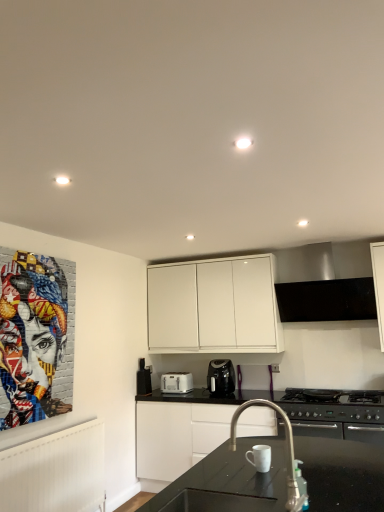
Measure the distance between point (191, 378) and camera.

The depth of point (191, 378) is 4.63 meters.

What do you see at coordinates (221, 377) in the screenshot? The image size is (384, 512). I see `black plastic coffee maker at center, which ranks as the 1th kitchen appliance in right-to-left order` at bounding box center [221, 377].

In the scene shown: In order to face black plastic coffee maker at center, which ranks as the 1th kitchen appliance in right-to-left order, should I rotate leftwards or rightwards?

You should look right and rotate roughly 3.777 degrees.

In the scene shown: Measure the distance between point (x=5, y=273) and camera.

The depth of point (x=5, y=273) is 2.90 meters.

Where is `black plastic toaster at lower center, which ranks as the first appliance in back-to-front order`? The height and width of the screenshot is (512, 384). black plastic toaster at lower center, which ranks as the first appliance in back-to-front order is located at coordinates (143, 378).

What do you see at coordinates (217, 502) in the screenshot? The image size is (384, 512). I see `black glossy sink at center` at bounding box center [217, 502].

The height and width of the screenshot is (512, 384). What are the coordinates of `satin nickel faucet at center` in the screenshot? It's located at (288, 456).

You are a GUI agent. You are given a task and a screenshot of the screen. Output one action in this format:
    pyautogui.click(x=<x>, y=<y>)
    Task: Click on the white plastic toaster at center, the 1th kitchen appliance from the left
    The height and width of the screenshot is (512, 384).
    Given the screenshot: What is the action you would take?
    pyautogui.click(x=176, y=382)

Is white plastic toaster at center, the second kitchen appliance positioned from the right, placed right next to satin nickel faucet at center?

No, white plastic toaster at center, the second kitchen appliance positioned from the right, is not making contact with satin nickel faucet at center.

From the image's perspective, which is below, white plastic toaster at center, the second kitchen appliance positioned from the right, or satin nickel faucet at center?

white plastic toaster at center, the second kitchen appliance positioned from the right, appears lower in the image.

Considering the points (192, 388) and (302, 498), which point is behind, point (192, 388) or point (302, 498)?

Positioned behind is point (192, 388).

Can satin nickel faucet at center be found inside white plastic toaster at center, the 1th kitchen appliance from the left?

No, white plastic toaster at center, the 1th kitchen appliance from the left, does not contain satin nickel faucet at center.

Looking at this image, which is more distant, (223, 382) or (266, 458)?

The point (223, 382) is behind.

From the image's perspective, is black plastic coffee maker at center, which ranks as the 1th kitchen appliance in right-to-left order, beneath white ceramic mug at lower center, the second appliance positioned from the back?

Correct, black plastic coffee maker at center, which ranks as the 1th kitchen appliance in right-to-left order, appears lower than white ceramic mug at lower center, the second appliance positioned from the back, in the image.

How different are the orientations of black plastic coffee maker at center, which ranks as the 1th kitchen appliance in right-to-left order, and white ceramic mug at lower center, the first appliance in the top-to-bottom sequence, in degrees?

They differ by 93 degrees in their facing directions.

Is black plastic coffee maker at center, which ranks as the 1th kitchen appliance in right-to-left order, turned away from white ceramic mug at lower center, placed as the 1th appliance when sorted from right to left?

No, black plastic coffee maker at center, which ranks as the 1th kitchen appliance in right-to-left order,'s orientation is not away from white ceramic mug at lower center, placed as the 1th appliance when sorted from right to left.

Based on the photo, what's the angular difference between white ceramic mug at lower center, the second appliance positioned from the back, and white plastic toaster at center, the second kitchen appliance positioned from the right,'s facing directions?

The angle between the facing direction of white ceramic mug at lower center, the second appliance positioned from the back, and the facing direction of white plastic toaster at center, the second kitchen appliance positioned from the right, is 93 degrees.

From the picture: Is white ceramic mug at lower center, which is the 2th appliance from bottom to top, far from white plastic toaster at center, the 1th kitchen appliance from the left?

Yes.

Identify the location of appliance below the white plastic toaster at center, the 1th kitchen appliance from the left (from a real-world perspective). (260, 457).

Based on the photo, could white plastic toaster at center, the second kitchen appliance positioned from the right, be considered to be inside white ceramic mug at lower center, the second appliance positioned from the back?

Definitely not — white plastic toaster at center, the second kitchen appliance positioned from the right, is not inside white ceramic mug at lower center, the second appliance positioned from the back.

From a real-world perspective, is satin nickel faucet at center under black matte gas stove at lower right?

No, from a real-world perspective, satin nickel faucet at center is not beneath black matte gas stove at lower right.

In the scene shown: How different are the orientations of satin nickel faucet at center and black matte gas stove at lower right in degrees?

The angle between the facing direction of satin nickel faucet at center and the facing direction of black matte gas stove at lower right is 90.2 degrees.

From the image's perspective, is satin nickel faucet at center on black matte gas stove at lower right?

Yes, from the image's perspective, satin nickel faucet at center is above black matte gas stove at lower right.

In the scene shown: Considering the relative sizes of satin nickel faucet at center and black matte gas stove at lower right in the image provided, is satin nickel faucet at center thinner than black matte gas stove at lower right?

Correct, the width of satin nickel faucet at center is less than that of black matte gas stove at lower right.

Between point (349, 404) and point (223, 369), which one is positioned in front?

Point (349, 404)

Is black matte gas stove at lower right looking in the opposite direction of black plastic coffee maker at center, the 2th kitchen appliance from the left?

No, black matte gas stove at lower right's orientation is not away from black plastic coffee maker at center, the 2th kitchen appliance from the left.

In the scene shown: From a real-world perspective, does black matte gas stove at lower right stand above black plastic coffee maker at center, the 2th kitchen appliance from the left?

Actually, black matte gas stove at lower right is physically below black plastic coffee maker at center, the 2th kitchen appliance from the left, in the real world.

From a real-world perspective, between white matte cabinet at center, the second cabinetry when ordered from top to bottom, and black glossy sink at center, who is vertically higher?

black glossy sink at center.

Between white matte cabinet at center, placed as the first cabinetry when sorted from bottom to top, and black glossy sink at center, which one appears on the left side from the viewer's perspective?

From the viewer's perspective, black glossy sink at center appears more on the left side.

What's the angular difference between white matte cabinet at center, the second cabinetry when ordered from top to bottom, and black glossy sink at center's facing directions?

The angle between the facing direction of white matte cabinet at center, the second cabinetry when ordered from top to bottom, and the facing direction of black glossy sink at center is 90.9 degrees.

Is black plastic coffee maker at center, which ranks as the 1th kitchen appliance in right-to-left order, closer to the viewer compared to white plastic toaster at center, the 1th kitchen appliance from the left?

Yes, black plastic coffee maker at center, which ranks as the 1th kitchen appliance in right-to-left order, is closer to the camera.

Considering the points (224, 367) and (162, 374), which point is behind, point (224, 367) or point (162, 374)?

The point (162, 374) is more distant.

From the image's perspective, is black plastic coffee maker at center, which ranks as the 1th kitchen appliance in right-to-left order, below white plastic toaster at center, the second kitchen appliance positioned from the right?

Actually, black plastic coffee maker at center, which ranks as the 1th kitchen appliance in right-to-left order, appears above white plastic toaster at center, the second kitchen appliance positioned from the right, in the image.

Based on the photo, considering the relative positions of black plastic coffee maker at center, which ranks as the 1th kitchen appliance in right-to-left order, and white plastic toaster at center, the second kitchen appliance positioned from the right, in the image provided, is black plastic coffee maker at center, which ranks as the 1th kitchen appliance in right-to-left order, to the left of white plastic toaster at center, the second kitchen appliance positioned from the right, from the viewer's perspective?

In fact, black plastic coffee maker at center, which ranks as the 1th kitchen appliance in right-to-left order, is to the right of white plastic toaster at center, the second kitchen appliance positioned from the right.

The height and width of the screenshot is (512, 384). Find the location of `tap in front of the white plastic toaster at center, the 1th kitchen appliance from the left`. tap in front of the white plastic toaster at center, the 1th kitchen appliance from the left is located at coordinates (288, 456).

Find the location of a particular element. This screenshot has width=384, height=512. appliance above the black plastic coffee maker at center, the 2th kitchen appliance from the left (from the image's perspective) is located at coordinates (260, 457).

When comparing their distances from colorful mosaic portrait at left, does black plastic coffee maker at center, the 2th kitchen appliance from the left, or white matte cabinet at center, placed as the first cabinetry when sorted from bottom to top, seem closer?

white matte cabinet at center, placed as the first cabinetry when sorted from bottom to top, lies closer to colorful mosaic portrait at left than the other object.

Estimate the real-world distances between objects in this image. Which object is closer to satin nickel faucet at center, white matte cabinet at center, placed as the first cabinetry when sorted from bottom to top, or white matte cabinet at upper center, which ranks as the 2th cabinetry in bottom-to-top order?

white matte cabinet at center, placed as the first cabinetry when sorted from bottom to top.

From the image, which object appears to be nearer to satin silver exhaust hood at upper center, white matte cabinet at upper center, the 1th cabinetry when ordered from top to bottom, or black plastic coffee maker at center, which ranks as the 1th kitchen appliance in right-to-left order?

white matte cabinet at upper center, the 1th cabinetry when ordered from top to bottom, is closer to satin silver exhaust hood at upper center.

Considering their positions, is white matte cabinet at upper center, which ranks as the 2th cabinetry in bottom-to-top order, positioned closer to white ceramic mug at lower center, arranged as the 2th appliance when viewed from the left, than black glossy sink at center?

black glossy sink at center is positioned closer to the anchor white ceramic mug at lower center, arranged as the 2th appliance when viewed from the left.

From the image, which object appears to be nearer to black glossy sink at center, colorful mosaic portrait at left or white matte cabinet at center, the second cabinetry when ordered from top to bottom?

colorful mosaic portrait at left is positioned closer to the anchor black glossy sink at center.

Which object lies further to the anchor point satin silver exhaust hood at upper center, white ceramic mug at lower center, arranged as the 2th appliance when viewed from the left, or white matte cabinet at center, placed as the first cabinetry when sorted from bottom to top?

Among the two, white ceramic mug at lower center, arranged as the 2th appliance when viewed from the left, is located further to satin silver exhaust hood at upper center.

Considering their positions, is black glossy sink at center positioned further to colorful mosaic portrait at left than black plastic coffee maker at center, the 2th kitchen appliance from the left?

Among the two, black plastic coffee maker at center, the 2th kitchen appliance from the left, is located further to colorful mosaic portrait at left.

Based on their spatial positions, is black plastic coffee maker at center, the 2th kitchen appliance from the left, or black glossy sink at center further from satin silver exhaust hood at upper center?

Based on the image, black glossy sink at center appears to be further to satin silver exhaust hood at upper center.

The width and height of the screenshot is (384, 512). In order to click on gas stove located between white ceramic mug at lower center, the first appliance in the front-to-back sequence, and satin silver exhaust hood at upper center in the depth direction in this screenshot , I will do `click(334, 405)`.

Locate an element on the screen. This screenshot has height=512, width=384. person located between white ceramic mug at lower center, the second appliance positioned from the back, and white matte cabinet at center, placed as the first cabinetry when sorted from bottom to top, in the depth direction is located at coordinates (35, 337).

Where is `person between black glossy sink at center and black plastic coffee maker at center, which ranks as the 1th kitchen appliance in right-to-left order, along the z-axis`? This screenshot has height=512, width=384. person between black glossy sink at center and black plastic coffee maker at center, which ranks as the 1th kitchen appliance in right-to-left order, along the z-axis is located at coordinates (35, 337).

Locate an element on the screen. The width and height of the screenshot is (384, 512). cabinetry between white ceramic mug at lower center, arranged as the 2th appliance when viewed from the left, and satin silver exhaust hood at upper center in the front-back direction is located at coordinates (177, 436).